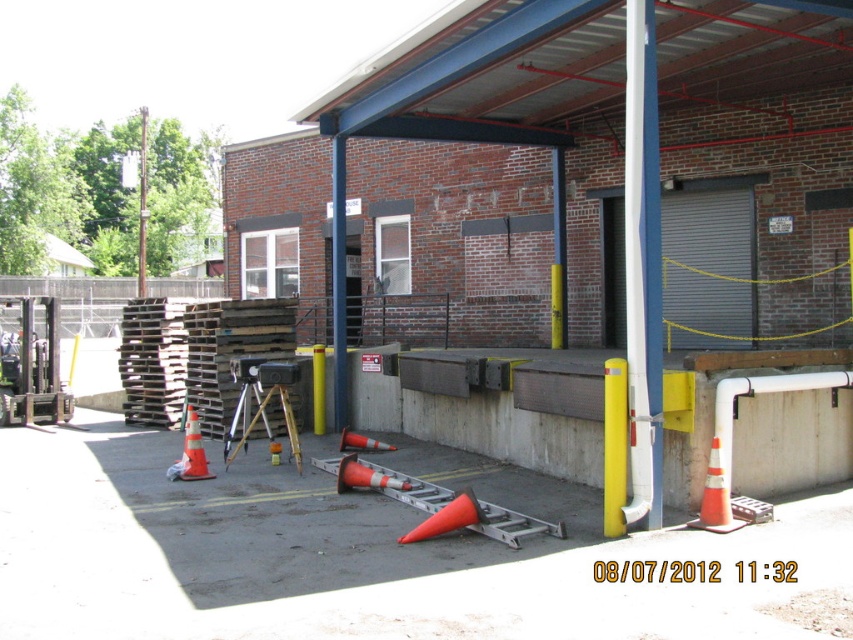
You are a safety inspector checking the construction site. You notice the orange reflective cone at lower right and the brushed metal pole at upper center. Which object is smaller in size?

The orange reflective cone at lower right is smaller in size compared to the brushed metal pole at upper center.

You are standing at the center of the paved area in the construction site scene. You see a point marked at coordinates [717,496]. Which object is this point located on?

The point at [717,496] is on the orange reflective cone at lower right.